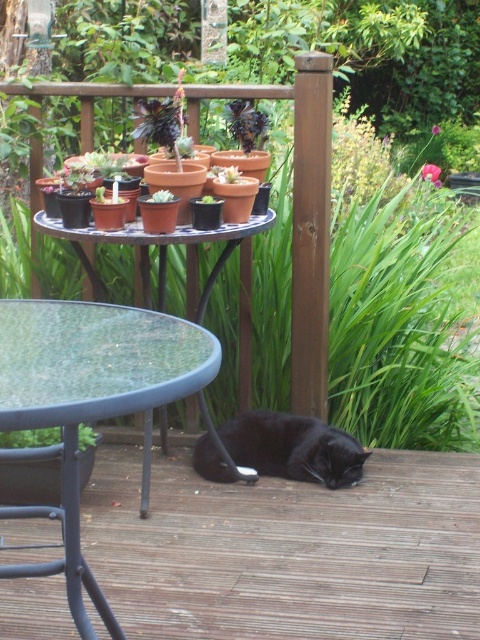
You are standing on the brown wooden deck at center and want to reach the transparent glass table at lower left. Which direction should you move to get closer to the table?

Since the brown wooden deck at center is closer to you than the transparent glass table at lower left, you should move forward towards the transparent glass table at lower left to get closer to it.

You are a small robot with a 25 cm wide base. You need to move from the brown wooden deck at center to the black matte cat at lower center. Can your base fit through the space between them?

The distance between the brown wooden deck at center and the black matte cat at lower center is 30.07 centimeters. Since your base is only 25 cm wide, it can fit through the space between them.

You are a photographer trying to capture a clear shot of the black matte cat at lower center. However, the glassy transparent table at center is blocking your view. Can you adjust your position to see the cat without the table obstructing the view?

The glassy transparent table at center is taller than the black matte cat at lower center, so if you lower your camera angle or move to a lower position, you can position it below the table to capture the cat without obstruction.